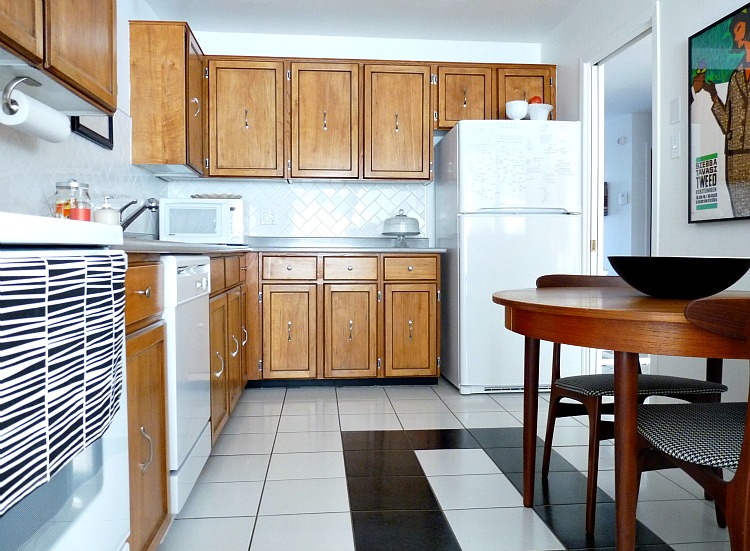
The height and width of the screenshot is (551, 750). I want to click on dish towel, so click(32, 352).